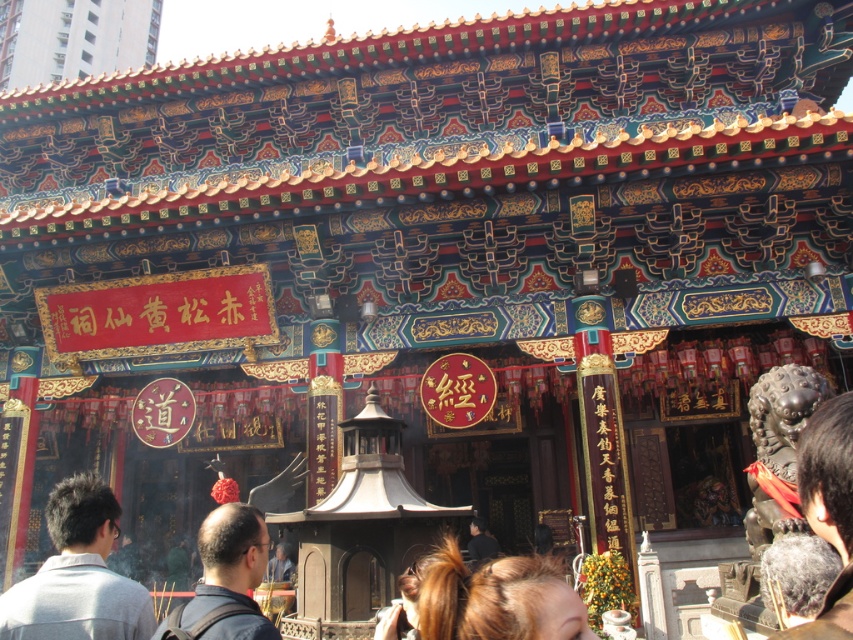
You are a visitor standing at the entrance of the temple. You notice a gray fabric shirt at lower left and a black stone lion at lower right. Which object is wider from your perspective?

The gray fabric shirt at lower left might be wider than black stone lion at lower right.

You are standing in front of the temple and notice two fabrics. The gray fabric shirt at lower left and the dark blue fabric at center. Which fabric is shorter in height?

The gray fabric shirt at lower left has a lesser height compared to dark blue fabric at center, so the gray fabric shirt at lower left is shorter in height.

You are a visitor standing in front of the temple and see the gray fabric shirt at lower left and the black stone lion at lower right. Which object is positioned more to the left side of the temple?

The gray fabric shirt at lower left is positioned more to the left side of the temple than the black stone lion at lower right.